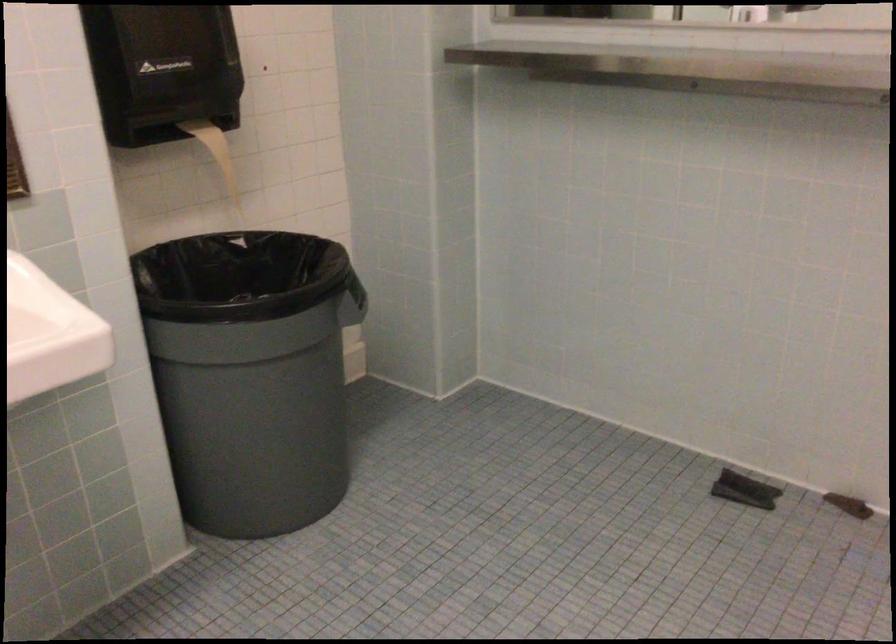
Which object does [161,69] point to?

It corresponds to the dispensed paper towel in the image.